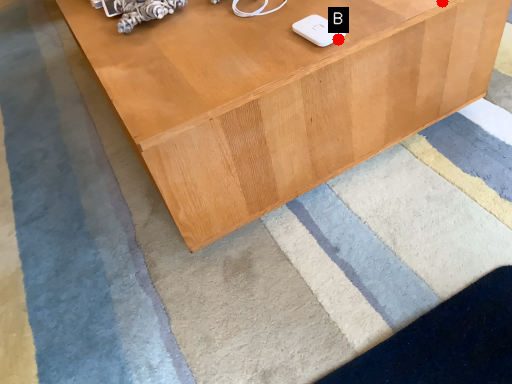
Question: Two points are circled on the image, labeled by A and B beside each circle. Which point is further to the camera?

Choices:
 (A) A is further
 (B) B is further

Answer: (A)